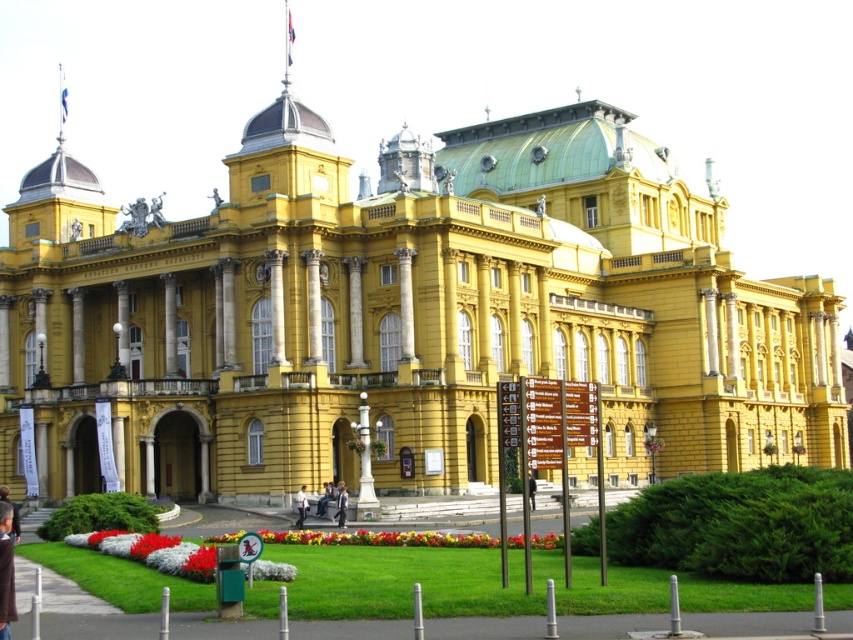
Question: Among these objects, which one is nearest to the camera?

Choices:
 (A) blonde hair at lower left
 (B) light blue jeans at center
 (C) black leather jacket at center

Answer: (A)

Question: Can you confirm if brown leather jacket at lower left is positioned above light blue shirt at center?

Choices:
 (A) yes
 (B) no

Answer: (A)

Question: Which object is closer to the camera taking this photo?

Choices:
 (A) brown leather jacket at lower left
 (B) black leather jacket at center
 (C) light blue fabric jacket at center
 (D) light blue shirt at center

Answer: (A)

Question: Is blonde hair at lower left below light blue jeans at center?

Choices:
 (A) no
 (B) yes

Answer: (A)

Question: Is light blue fabric jacket at center closer to camera compared to black leather jacket at center?

Choices:
 (A) yes
 (B) no

Answer: (B)

Question: Which object appears farthest from the camera in this image?

Choices:
 (A) light blue fabric jacket at center
 (B) light blue jeans at center
 (C) blonde hair at lower left

Answer: (B)